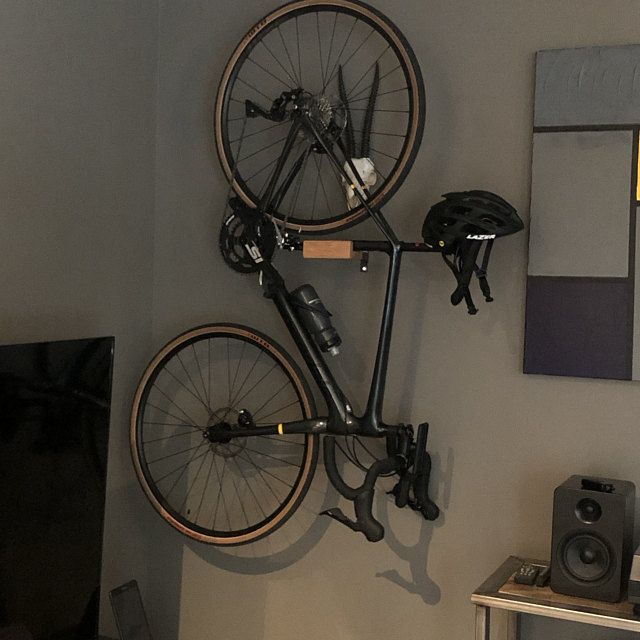
Find the location of a particular element. This screenshot has height=640, width=640. left speaker is located at coordinates (595, 548).